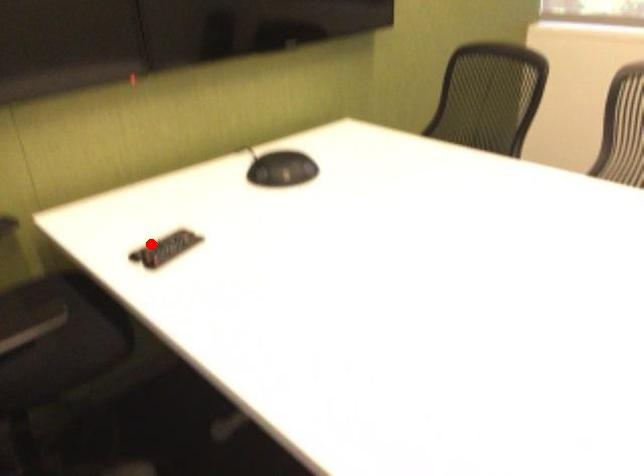
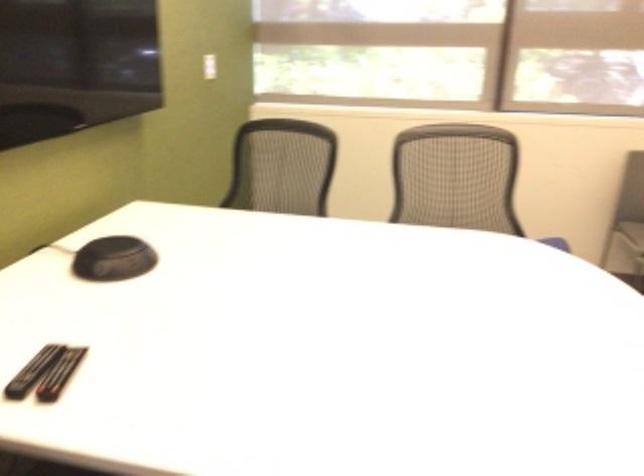
The point at the highlighted location is marked in the first image. Where is the corresponding point in the second image?

(32, 371)